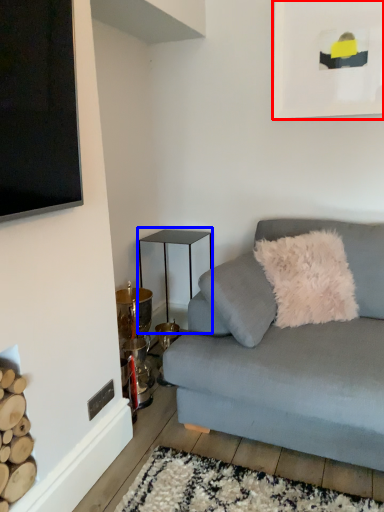
Question: Which point is further to the camera, picture frame (highlighted by a red box) or table (highlighted by a blue box)?

Choices:
 (A) picture frame
 (B) table

Answer: (B)